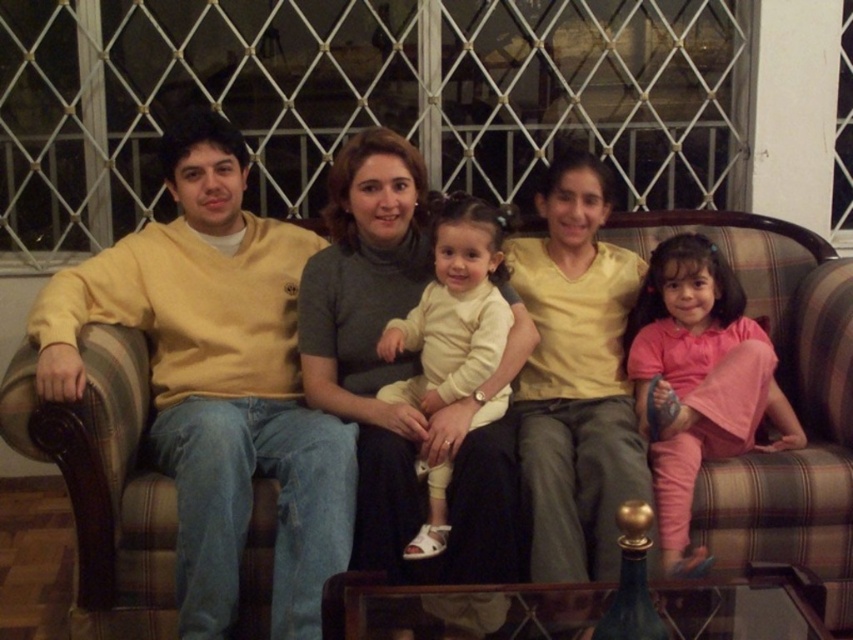
Can you confirm if matte gray sweater at center is positioned above matte yellow shirt at center?

Indeed, matte gray sweater at center is positioned over matte yellow shirt at center.

In the scene shown: How far apart are matte gray sweater at center and matte yellow shirt at center?

matte gray sweater at center and matte yellow shirt at center are 10.67 inches apart.

At what (x,y) coordinates should I click in order to perform the action: click on matte gray sweater at center. Please return your answer as a coordinate pair (x, y). Looking at the image, I should click on (404, 376).

Does matte yellow shirt at center appear over white soft fabric baby at center?

Actually, matte yellow shirt at center is below white soft fabric baby at center.

Is matte yellow shirt at center thinner than white soft fabric baby at center?

No, matte yellow shirt at center is not thinner than white soft fabric baby at center.

This screenshot has width=853, height=640. Describe the element at coordinates (576, 378) in the screenshot. I see `matte yellow shirt at center` at that location.

Locate an element on the screen. This screenshot has width=853, height=640. matte yellow shirt at center is located at coordinates (576, 378).

In the scene shown: Does yellow cotton sweater at left come in front of pink cotton dress at right?

Yes, yellow cotton sweater at left is closer to the viewer.

Can you confirm if yellow cotton sweater at left is thinner than pink cotton dress at right?

No.

Is point (57, 353) closer to camera compared to point (732, 429)?

Yes, point (57, 353) is closer to viewer.

Identify the location of yellow cotton sweater at left. Image resolution: width=853 pixels, height=640 pixels. [218, 380].